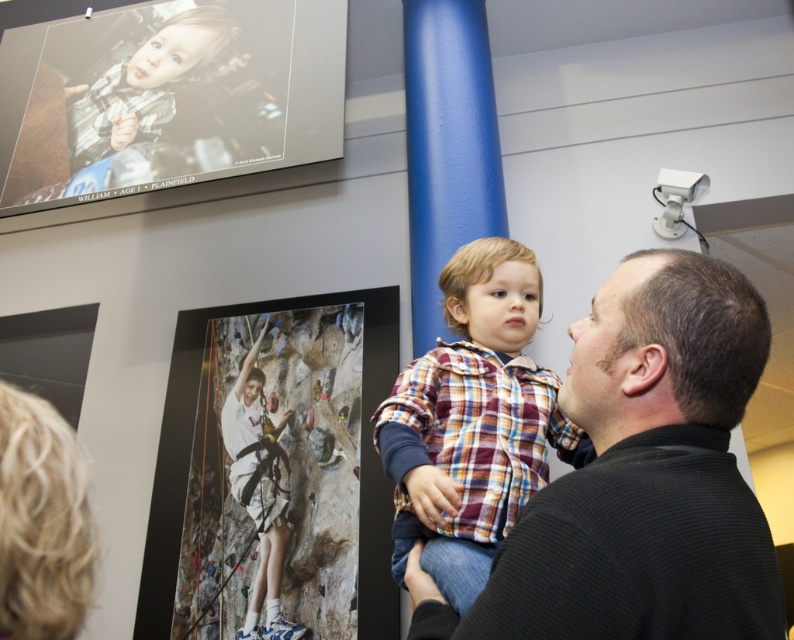
You are standing in the museum and see the black textured shirt at center. What are the coordinates of its position?

The coordinates of the black textured shirt at center are at point (642,476).

You are an observer standing in the room. You see the black textured shirt at center and the white cotton shirt at upper center. Which one is shorter in height?

The black textured shirt at center is not as tall as the white cotton shirt at upper center, so the black textured shirt at center is shorter in height.

You are standing in the museum and want to take a photo of the black textured shirt at center without any obstructions. Is there enough space between you and the shirt to avoid the child in front?

The black textured shirt at center is 18.59 inches away from the camera. Since the child is in front of the shirt, this distance may not be sufficient to avoid capturing the child in the photo. Adjust your position or zoom in to focus on the shirt while minimizing the child in the frame.